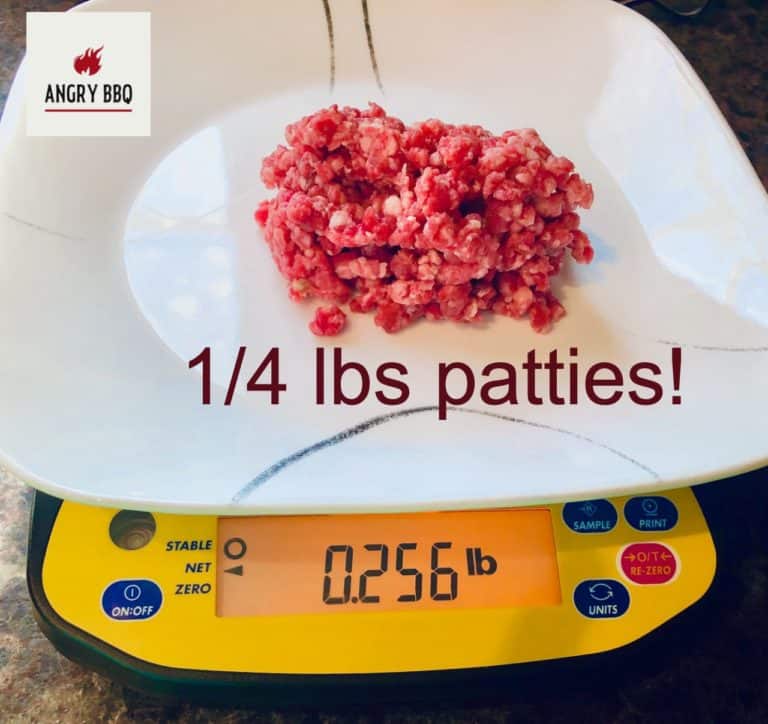
You are a GUI agent. You are given a task and a screenshot of the screen. Output one action in this format:
    pyautogui.click(x=<x>, y=<y>)
    Task: Click on the either granite or marble countertops i can't remember which that is
    
    Given the screenshot: What is the action you would take?
    pyautogui.click(x=752, y=70), pyautogui.click(x=44, y=673)